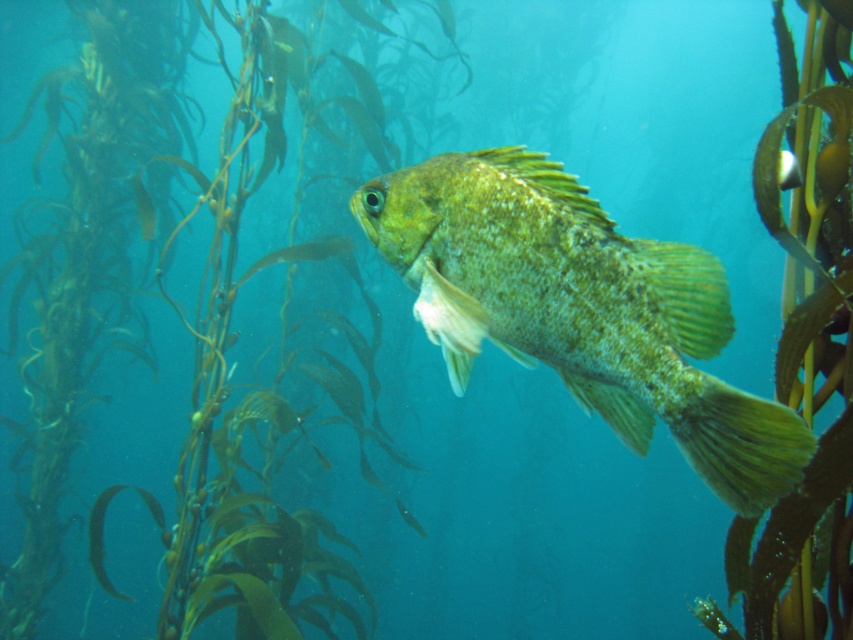
You are a marine biologist observing an underwater scene. You notice a point marked at coordinates (579, 308). What object does this point indicate?

The point at coordinates (579, 308) marks the green textured fish at center.

You are a marine biologist observing an underwater scene. You notice a green textured fish at center and a green leafy plant at center. Which object is shorter in height?

The green textured fish at center is shorter in height compared to the green leafy plant at center.

You are a marine biologist observing an underwater scene. You notice a green textured fish at center and a green leafy plant at center. Which object is smaller in size?

The green textured fish at center is smaller in size compared to the green leafy plant at center.